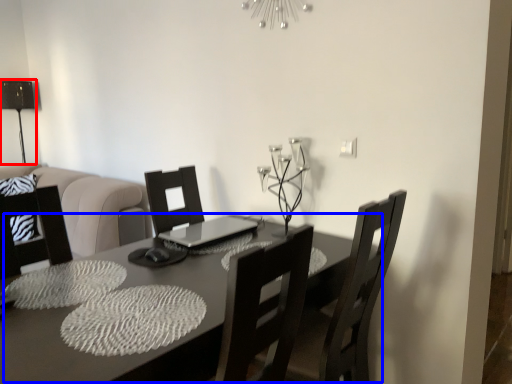
Question: Among these objects, which one is nearest to the camera, table lamp (highlighted by a red box) or table (highlighted by a blue box)?

Choices:
 (A) table lamp
 (B) table

Answer: (B)